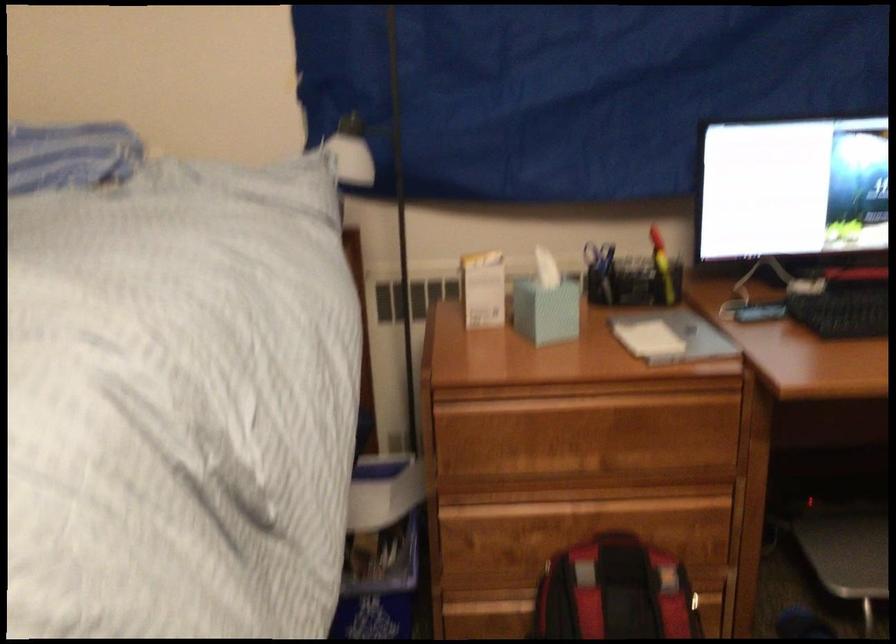
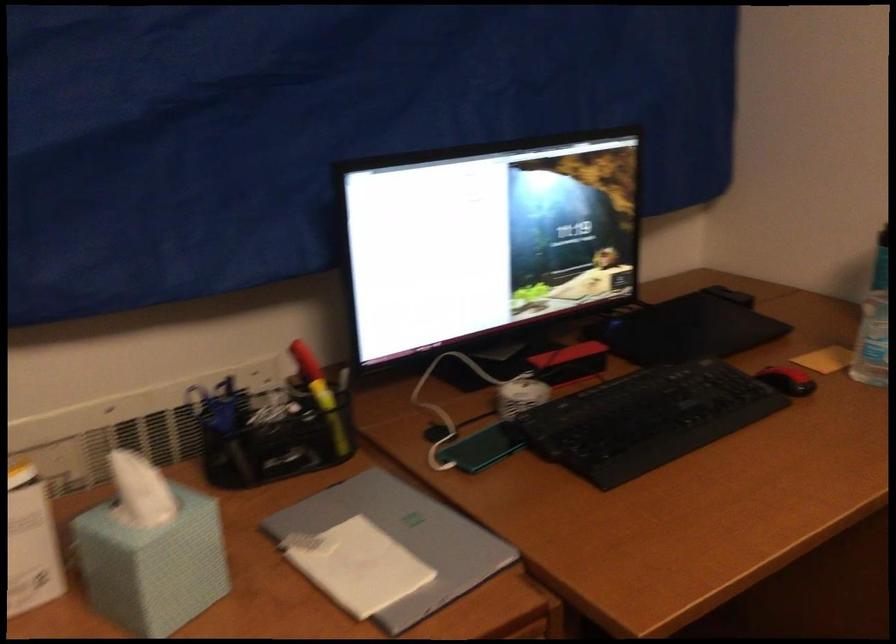
Locate, in the second image, the point that corresponds to [675,336] in the first image.

(403, 538)